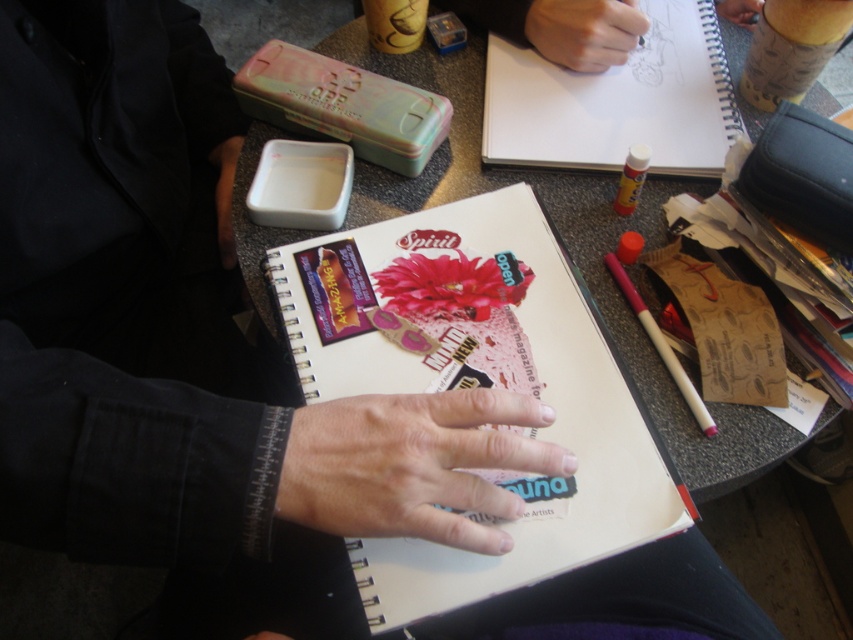
What is located at the coordinates point (x=412, y=465)?

At point (x=412, y=465) lies dry skin at center.